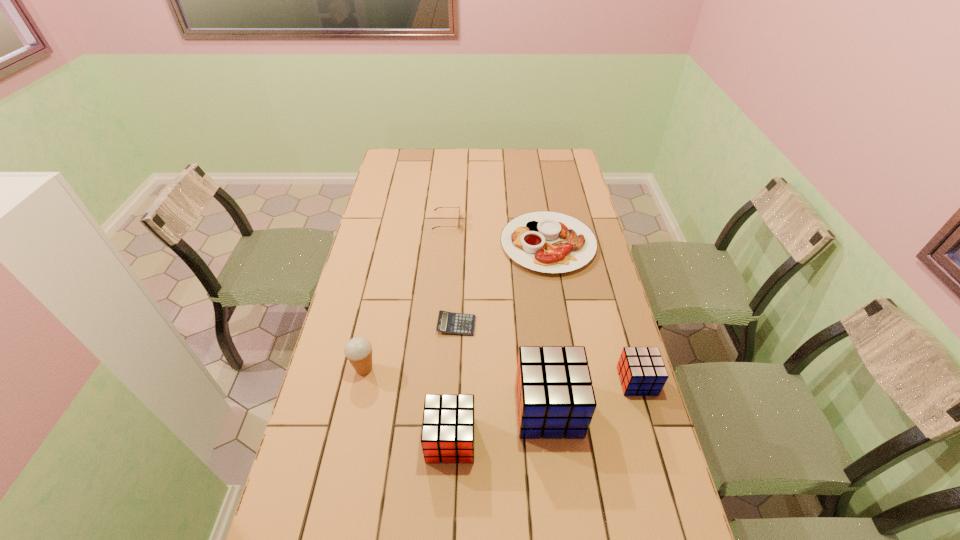
In order to click on the leftmost cube in this screenshot , I will do `click(448, 428)`.

At what (x,y) coordinates should I click in order to perform the action: click on the tallest cube. Please return your answer as a coordinate pair (x, y). This screenshot has height=540, width=960. Looking at the image, I should click on (555, 397).

Locate an element on the screen. This screenshot has height=540, width=960. the tallest object is located at coordinates (555, 397).

Where is `the shortest cube`? This screenshot has width=960, height=540. the shortest cube is located at coordinates (642, 372).

Where is `the fourth tallest object`? The image size is (960, 540). the fourth tallest object is located at coordinates (642, 372).

You are a GUI agent. You are given a task and a screenshot of the screen. Output one action in this format:
    pyautogui.click(x=<x>, y=<y>)
    Task: Click on the icecream
    The image size is (960, 540).
    Given the screenshot: What is the action you would take?
    pyautogui.click(x=358, y=350)

The image size is (960, 540). Identify the location of sunglasses. (458, 226).

Identify the location of calculator. Image resolution: width=960 pixels, height=540 pixels. (448, 322).

Find the location of a particular element. This screenshot has height=540, width=960. the shortest object is located at coordinates (448, 322).

This screenshot has height=540, width=960. Find the location of `the second shortest object`. the second shortest object is located at coordinates coord(544,241).